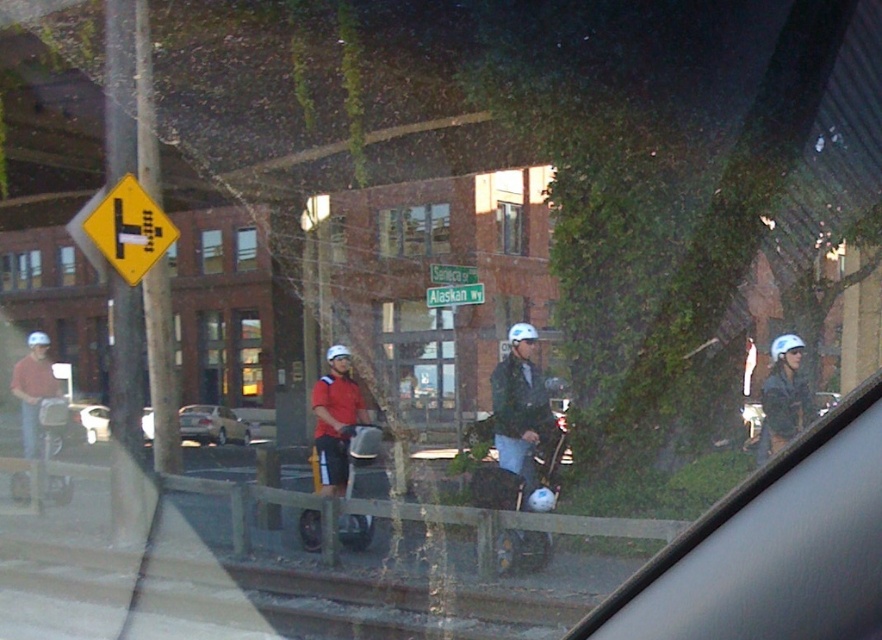
Question: Can you confirm if metallic silver scooter at left is bigger than green metallic street sign at center?

Choices:
 (A) no
 (B) yes

Answer: (A)

Question: Which point is farther to the camera?

Choices:
 (A) white matte safety helmet at upper right
 (B) green plastic street sign at center
 (C) metallic silver scooter at left

Answer: (B)

Question: Is metallic silver scooter at left positioned before green plastic street sign at center?

Choices:
 (A) no
 (B) yes

Answer: (B)

Question: Which point appears farthest from the camera in this image?

Choices:
 (A) (26, 429)
 (B) (772, 355)
 (C) (111, 225)

Answer: (A)

Question: Can you confirm if metallic silver scooter at left is smaller than gold metallic sedan at center?

Choices:
 (A) yes
 (B) no

Answer: (B)

Question: Among these points, which one is farthest from the camera?

Choices:
 (A) (452, 276)
 (B) (240, 435)

Answer: (B)